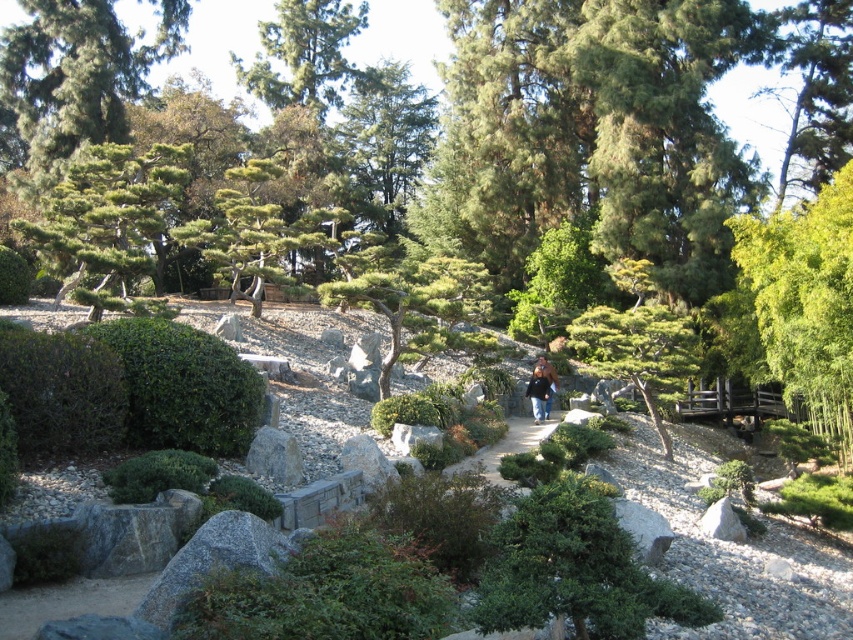
You are a gardener planning to water the green leafy bush at center and the green textured pine tree at upper left. Based on their positions, which one do you think is closer to the water source located at the bottom of the image?

The green leafy bush at center is closer to the water source located at the bottom of the image because it is positioned below the green textured pine tree at upper left.

In the scene shown: You are a visitor in the Japanese garden and want to take a photo of both the green bamboo at right and the green textured tree at center. Which one should you focus on first if you want to include both in your frame?

The green bamboo at right is positioned on the right side of the green textured tree at center, so you should focus on the green textured tree at center first to ensure both are in the frame.